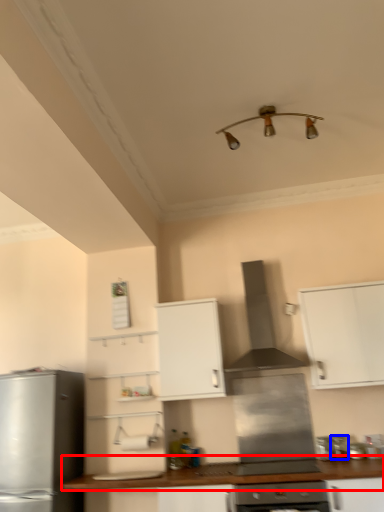
Question: Which point is closer to the camera, countertop (highlighted by a red box) or appliance (highlighted by a blue box)?

Choices:
 (A) countertop
 (B) appliance

Answer: (A)